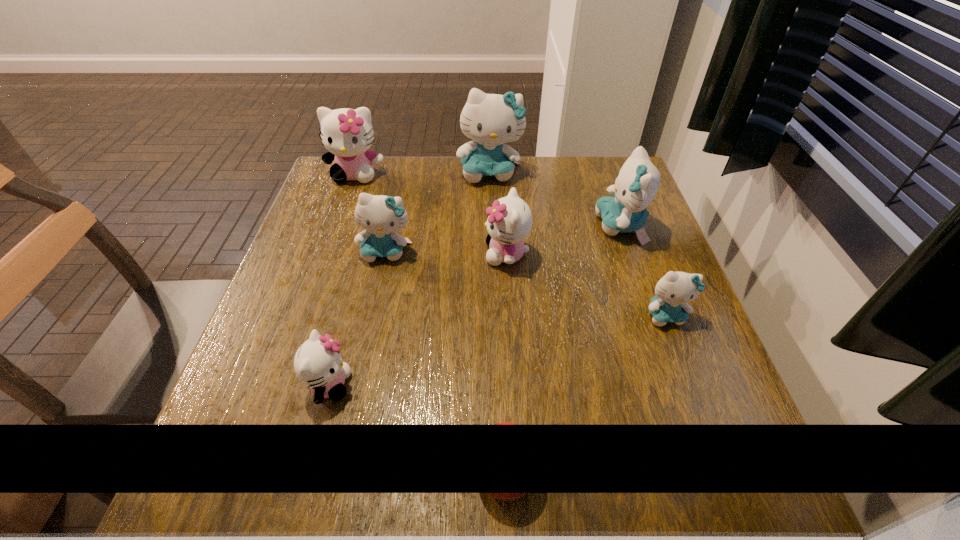
In the image, there is a desktop. Where is `free region at the right edge`? The width and height of the screenshot is (960, 540). free region at the right edge is located at coordinates (660, 390).

In the image, there is a desktop. Identify the location of free region at the near left corner. (200, 486).

At what (x,y) coordinates should I click in order to perform the action: click on unoccupied area between the farthest blue kitten and the leftmost blue kitten. Please return your answer as a coordinate pair (x, y). Looking at the image, I should click on point(438,212).

I want to click on vacant space in between the smallest white kitten and the shortest object, so click(418, 427).

Where is `free area in between the second biggest white kitten and the farthest white kitten`? The height and width of the screenshot is (540, 960). free area in between the second biggest white kitten and the farthest white kitten is located at coordinates (431, 214).

This screenshot has width=960, height=540. I want to click on unoccupied area between the smallest blue kitten and the nearest kitten, so click(497, 350).

Locate an element on the screen. The image size is (960, 540). vacant area that lies between the third biggest blue kitten and the nearest white kitten is located at coordinates (358, 319).

The height and width of the screenshot is (540, 960). In order to click on free area in between the smallest blue kitten and the second smallest white kitten in this screenshot , I will do `click(586, 285)`.

Locate an element on the screen. vacant space in between the farthest white kitten and the third smallest blue kitten is located at coordinates pos(489,200).

The image size is (960, 540). I want to click on unoccupied position between the smallest blue kitten and the smallest white kitten, so click(497, 350).